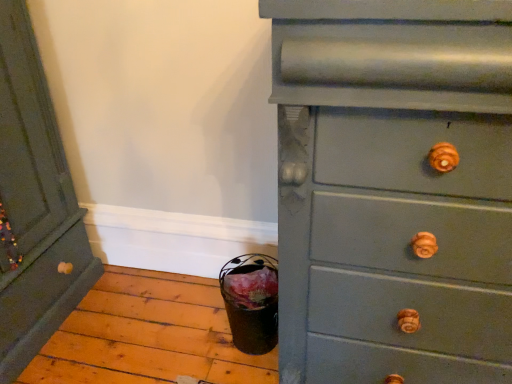
Question: From a real-world perspective, is matte gray dresser at right, the 2th chest of drawers when ordered from left to right, below matte green dresser at left, the second chest of drawers in the right-to-left sequence?

Choices:
 (A) yes
 (B) no

Answer: (B)

Question: Does matte gray dresser at right, the 1th chest of drawers positioned from the right, have a larger size compared to matte green dresser at left, the second chest of drawers in the right-to-left sequence?

Choices:
 (A) no
 (B) yes

Answer: (B)

Question: Is matte gray dresser at right, the 1th chest of drawers positioned from the right, to the right of matte green dresser at left, the second chest of drawers in the right-to-left sequence, from the viewer's perspective?

Choices:
 (A) no
 (B) yes

Answer: (B)

Question: Is matte gray dresser at right, the 2th chest of drawers when ordered from left to right, taller than matte green dresser at left, acting as the first chest of drawers starting from the left?

Choices:
 (A) no
 (B) yes

Answer: (B)

Question: Can you confirm if matte gray dresser at right, the 1th chest of drawers positioned from the right, is smaller than matte green dresser at left, the second chest of drawers in the right-to-left sequence?

Choices:
 (A) no
 (B) yes

Answer: (A)

Question: Does matte gray dresser at right, the 2th chest of drawers when ordered from left to right, have a greater width compared to matte green dresser at left, the second chest of drawers in the right-to-left sequence?

Choices:
 (A) no
 (B) yes

Answer: (A)

Question: Can you confirm if matte green dresser at left, the second chest of drawers in the right-to-left sequence, is shorter than matte gray dresser at right, the 2th chest of drawers when ordered from left to right?

Choices:
 (A) no
 (B) yes

Answer: (B)

Question: Is matte green dresser at left, the second chest of drawers in the right-to-left sequence, surrounding matte gray dresser at right, the 2th chest of drawers when ordered from left to right?

Choices:
 (A) yes
 (B) no

Answer: (B)

Question: From a real-world perspective, does matte green dresser at left, acting as the first chest of drawers starting from the left, stand above matte gray dresser at right, the 1th chest of drawers positioned from the right?

Choices:
 (A) no
 (B) yes

Answer: (A)

Question: From the image's perspective, would you say matte green dresser at left, acting as the first chest of drawers starting from the left, is positioned over matte gray dresser at right, the 1th chest of drawers positioned from the right?

Choices:
 (A) yes
 (B) no

Answer: (A)

Question: Is there a large distance between matte green dresser at left, acting as the first chest of drawers starting from the left, and matte gray dresser at right, the 2th chest of drawers when ordered from left to right?

Choices:
 (A) no
 (B) yes

Answer: (B)

Question: Are matte green dresser at left, the second chest of drawers in the right-to-left sequence, and matte gray dresser at right, the 2th chest of drawers when ordered from left to right, making contact?

Choices:
 (A) no
 (B) yes

Answer: (A)

Question: In the image, is matte green dresser at left, the second chest of drawers in the right-to-left sequence, on the left side or the right side of matte gray dresser at right, the 2th chest of drawers when ordered from left to right?

Choices:
 (A) left
 (B) right

Answer: (A)